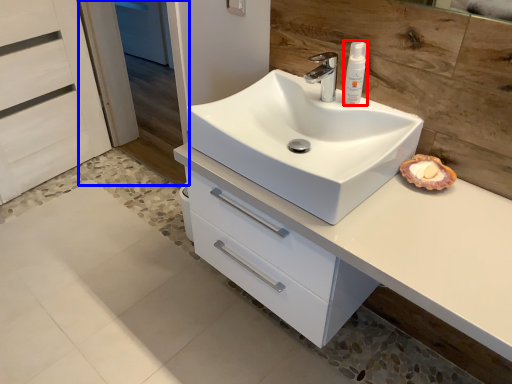
Question: Which point is closer to the camera, toiletry (highlighted by a red box) or screen door (highlighted by a blue box)?

Choices:
 (A) toiletry
 (B) screen door

Answer: (A)